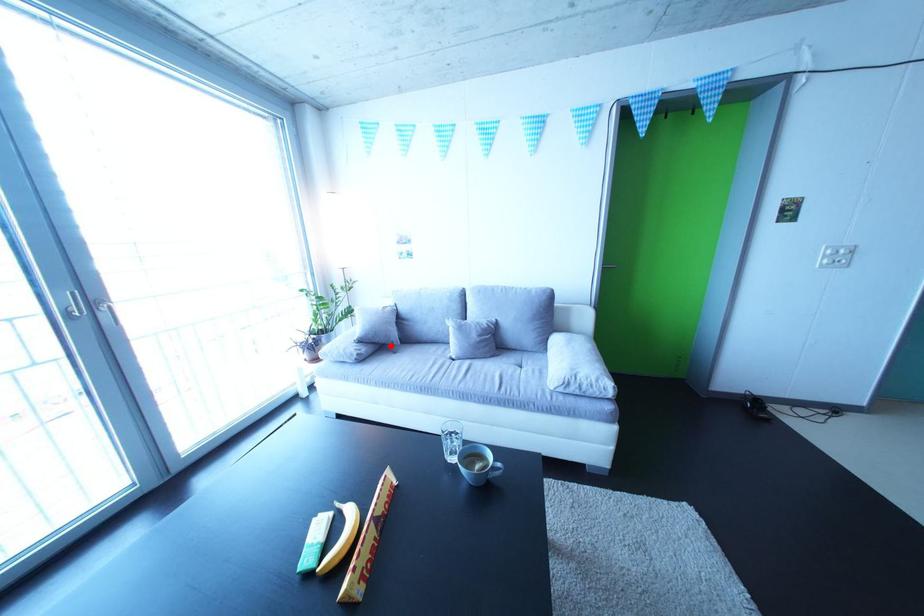
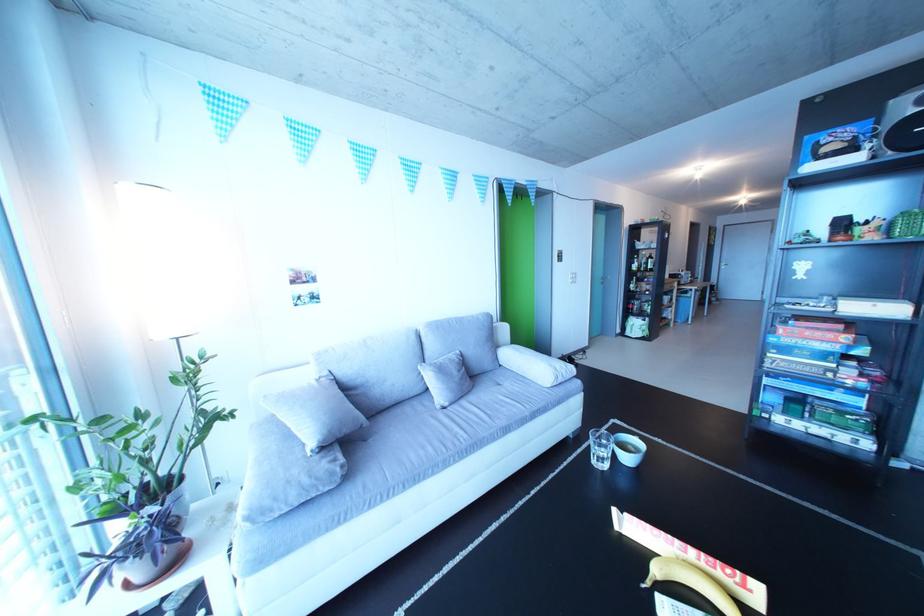
Find the pixel in the second image that matches the highlighted location in the first image.

(359, 437)